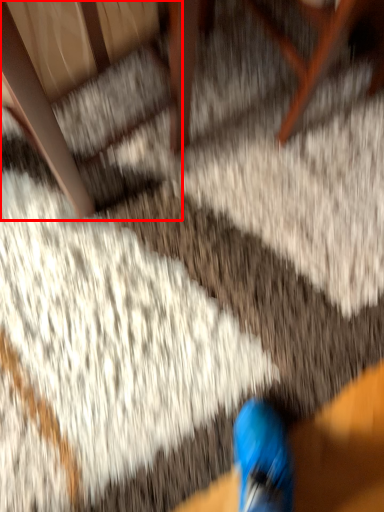
Question: Where is armchair (annotated by the red box) located in relation to furniture in the image?

Choices:
 (A) left
 (B) right

Answer: (A)